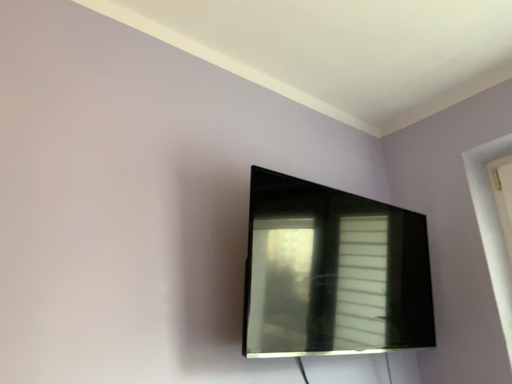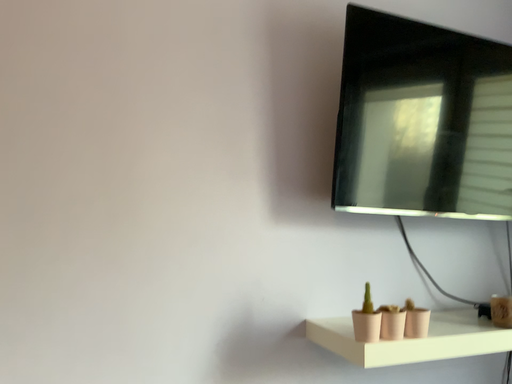
Question: Which way did the camera rotate in the video?

Choices:
 (A) rotated upward
 (B) rotated downward

Answer: (B)